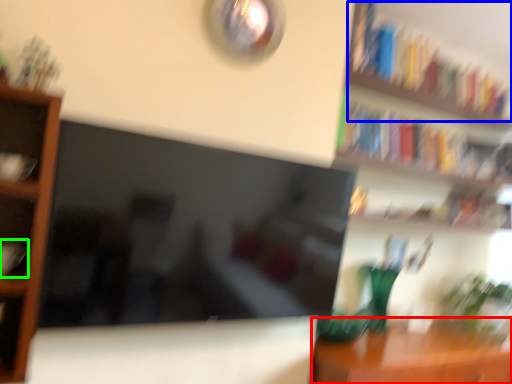
Question: Considering the real-world distances, which object is closest to table (highlighted by a red box)? book (highlighted by a blue box) or book (highlighted by a green box).

Choices:
 (A) book
 (B) book

Answer: (A)